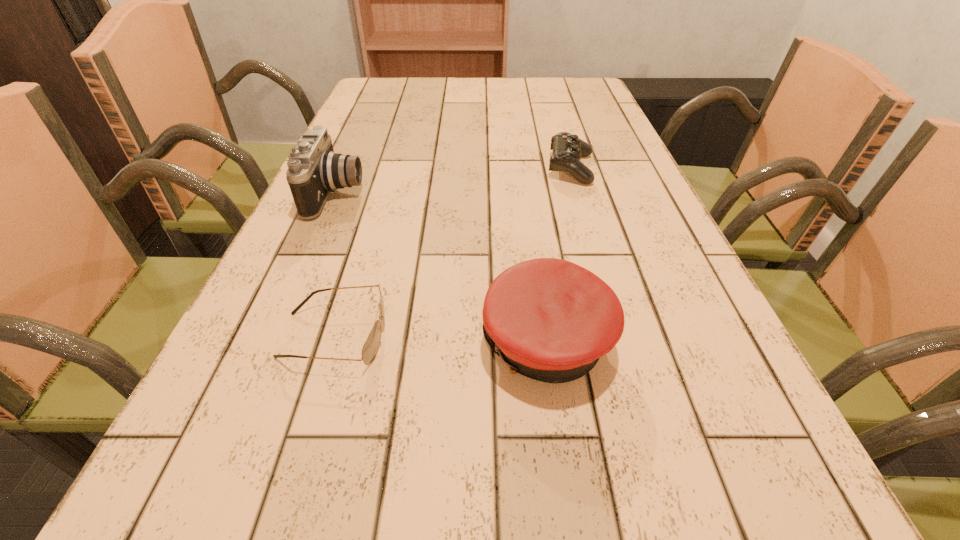
Locate an element on the screen. The image size is (960, 540). free spot that satisfies the following two spatial constraints: 1. on the front side of the third tallest object; 2. on the front-facing side of the camera is located at coordinates (579, 194).

You are a GUI agent. You are given a task and a screenshot of the screen. Output one action in this format:
    pyautogui.click(x=<x>, y=<y>)
    Task: Click on the vacant space that satisfies the following two spatial constraints: 1. on the front side of the second shortest object; 2. on the front-facing side of the shortest object
    
    Given the screenshot: What is the action you would take?
    pyautogui.click(x=621, y=335)